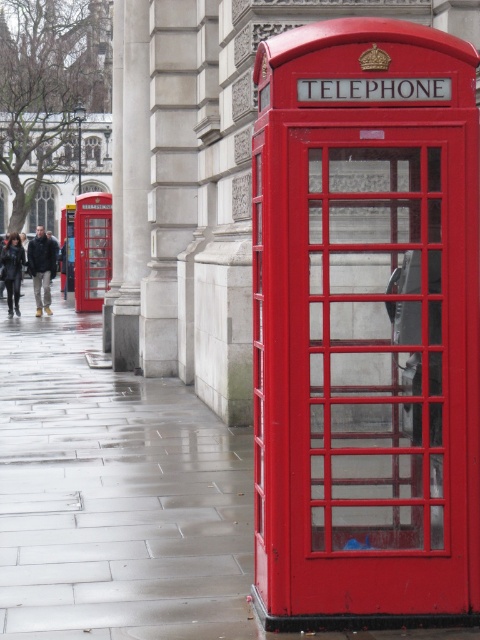
What do you see at coordinates (168, 177) in the screenshot?
I see `sanded stone column at center` at bounding box center [168, 177].

Does sanded stone column at center have a lesser width compared to dark brown leather jacket at left?

No, sanded stone column at center is not thinner than dark brown leather jacket at left.

Who is more distant from viewer, (173, 74) or (48, 252)?

The point (48, 252) is behind.

At what (x,y) coordinates should I click in order to perform the action: click on sanded stone column at center. Please return your answer as a coordinate pair (x, y). Looking at the image, I should click on (168, 177).

In the scene shown: Can you confirm if matte red telephone at center is positioned above glossy concrete pavement at lower left?

Indeed, matte red telephone at center is positioned over glossy concrete pavement at lower left.

In order to click on matte red telephone at center in this screenshot , I will do `click(365, 326)`.

Can you confirm if matte red telephone at center is positioned below dark brown leather jacket at left?

Indeed, matte red telephone at center is positioned under dark brown leather jacket at left.

Is matte red telephone at center positioned in front of dark brown leather jacket at left?

Yes, matte red telephone at center is closer to the viewer.

Where is `matte red telephone at center`? matte red telephone at center is located at coordinates (365, 326).